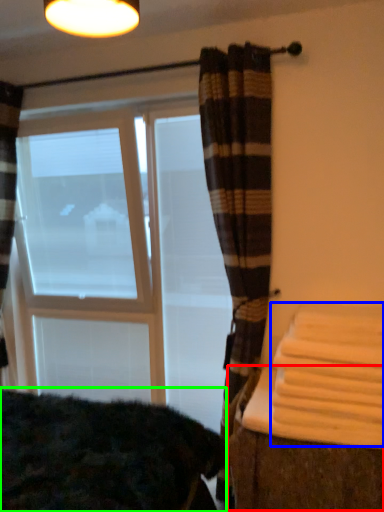
Question: Considering the real-world distances, which object is closest to table (highlighted by a red box)? bath towel (highlighted by a blue box) or bedding (highlighted by a green box).

Choices:
 (A) bath towel
 (B) bedding

Answer: (A)